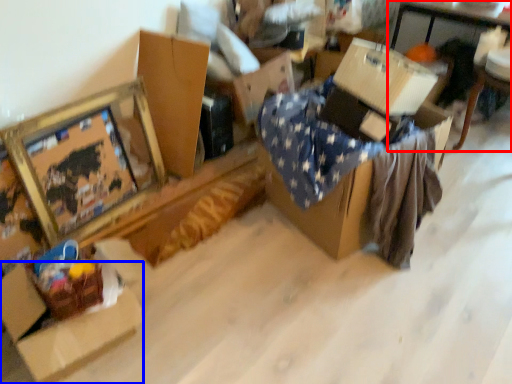
Question: Which of the following is the closest to the observer, table (highlighted by a red box) or cardboard box (highlighted by a blue box)?

Choices:
 (A) table
 (B) cardboard box

Answer: (B)